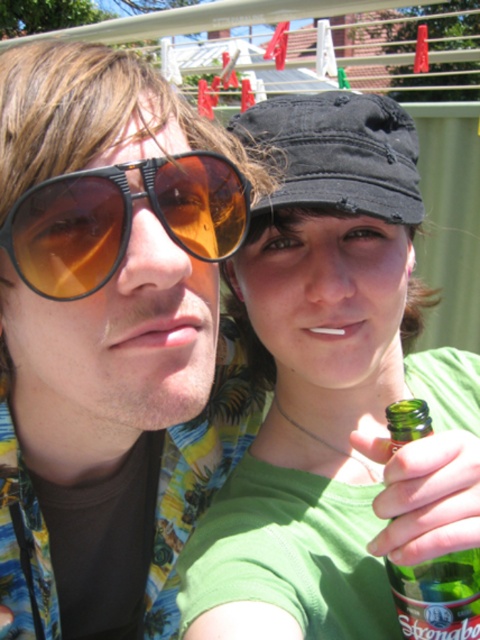
Is matte black sunglasses at left further to the viewer compared to green matte bottle at center?

Yes, it is behind green matte bottle at center.

Can you confirm if matte black sunglasses at left is positioned above green matte bottle at center?

No.

I want to click on matte black sunglasses at left, so click(x=110, y=339).

Identify the location of matte black sunglasses at left. (110, 339).

Can you confirm if green matte bottle at center is positioned below green glass bottle at lower right?

Incorrect, green matte bottle at center is not positioned below green glass bottle at lower right.

Between green matte bottle at center and green glass bottle at lower right, which one has less height?

Standing shorter between the two is green glass bottle at lower right.

I want to click on green matte bottle at center, so click(333, 388).

Is matte black sunglasses at left behind matte brown sunglasses at left?

That is True.

Is matte black sunglasses at left positioned in front of matte brown sunglasses at left?

No.

Where is `matte black sunglasses at left`? The width and height of the screenshot is (480, 640). matte black sunglasses at left is located at coordinates point(110,339).